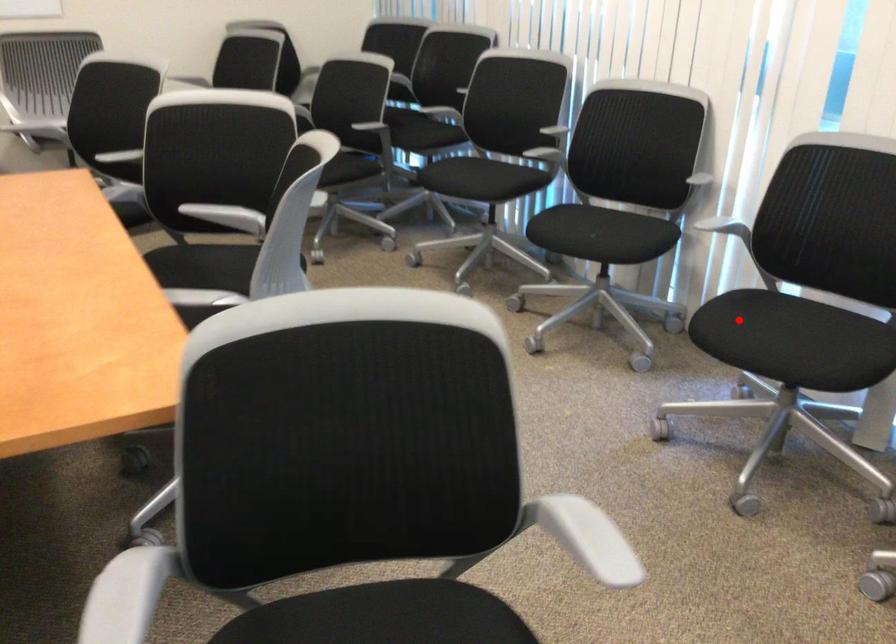
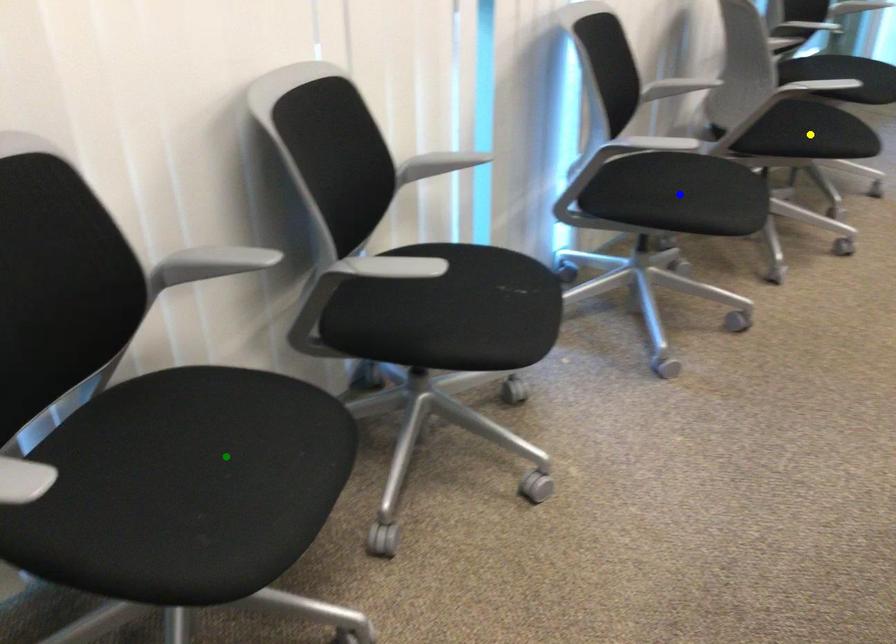
Question: I am providing you with two images of the same scene from different viewpoints. A red point is marked on the first image. You are given multiple points on the second image. Which mark in image 2 goes with the point in image 1?

Choices:
 (A) yellow point
 (B) green point
 (C) blue point

Answer: (C)